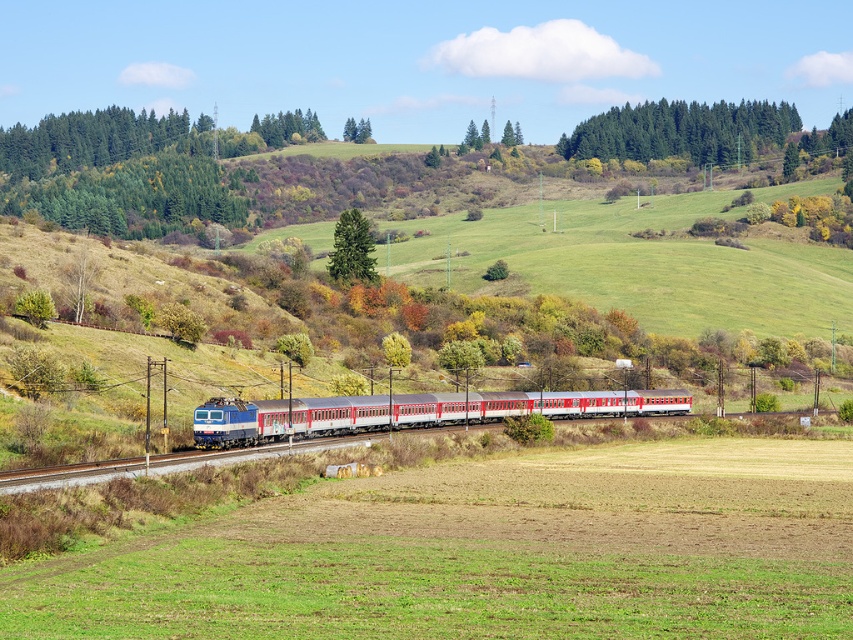
Is green grassy field at center thinner than green textured tree at center?

No, green grassy field at center is not thinner than green textured tree at center.

Is green grassy field at center shorter than green textured tree at center?

Correct, green grassy field at center is not as tall as green textured tree at center.

Is point (193, 566) positioned after point (337, 253)?

That is False.

Where is `green grassy field at center`? green grassy field at center is located at coordinates (488, 554).

Which of these two, green leafy forest at upper center or green textured tree at center, stands taller?

Standing taller between the two is green leafy forest at upper center.

Does green leafy forest at upper center appear over green textured tree at center?

Yes.

This screenshot has height=640, width=853. In order to click on green leafy forest at upper center in this screenshot , I will do `click(680, 131)`.

From the picture: Which is below, polished aluminum train at center or green leafy forest at upper center?

polished aluminum train at center

Is polished aluminum train at center taller than green leafy forest at upper center?

In fact, polished aluminum train at center may be shorter than green leafy forest at upper center.

In order to click on polished aluminum train at center in this screenshot , I will do `click(410, 412)`.

The image size is (853, 640). I want to click on polished aluminum train at center, so click(x=410, y=412).